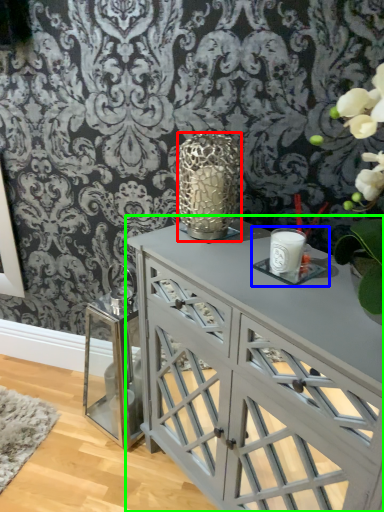
Question: Considering the real-world distances, which object is closest to candle holder (highlighted by a red box)? candle holder (highlighted by a blue box) or table (highlighted by a green box).

Choices:
 (A) candle holder
 (B) table

Answer: (A)